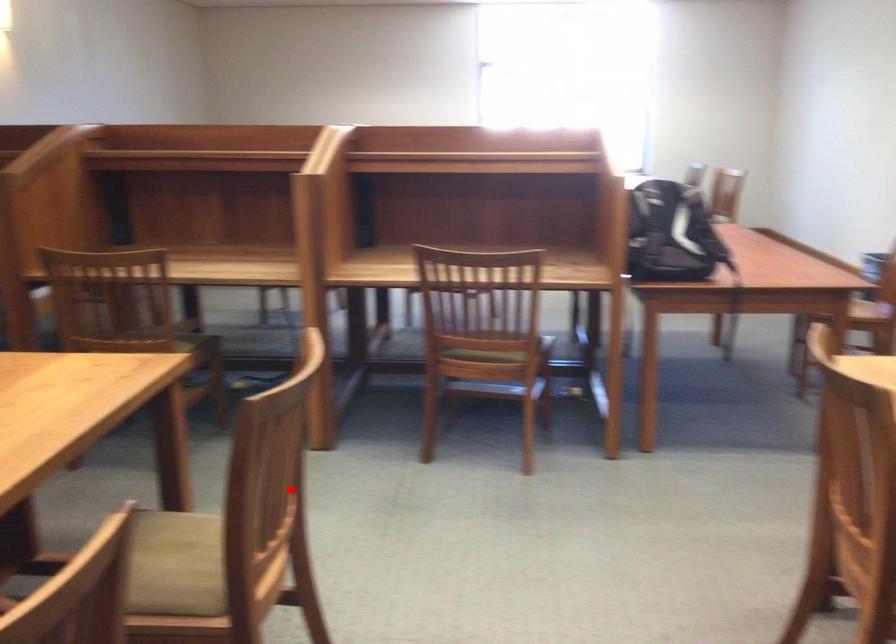
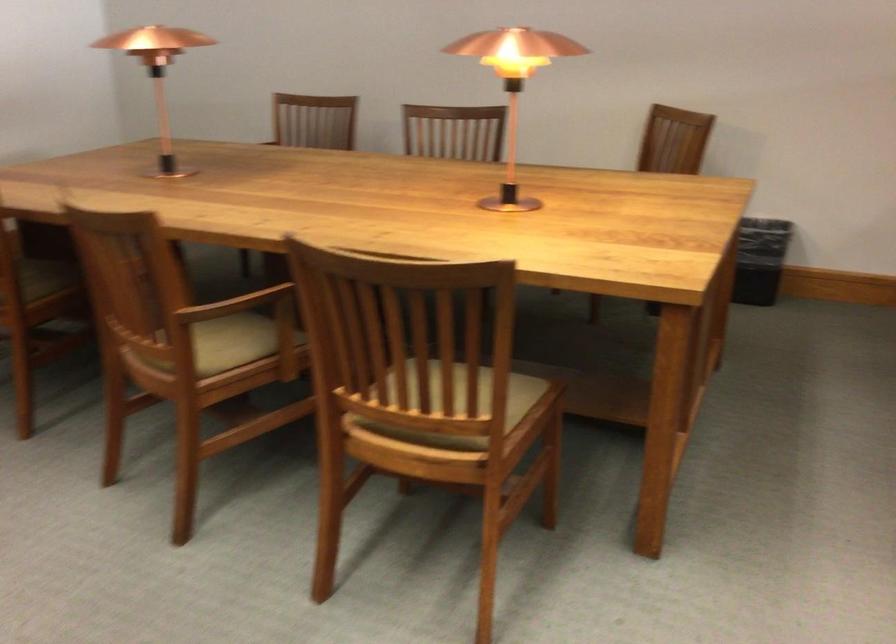
In the second image, find the point that corresponds to the highlighted location in the first image.

(460, 404)